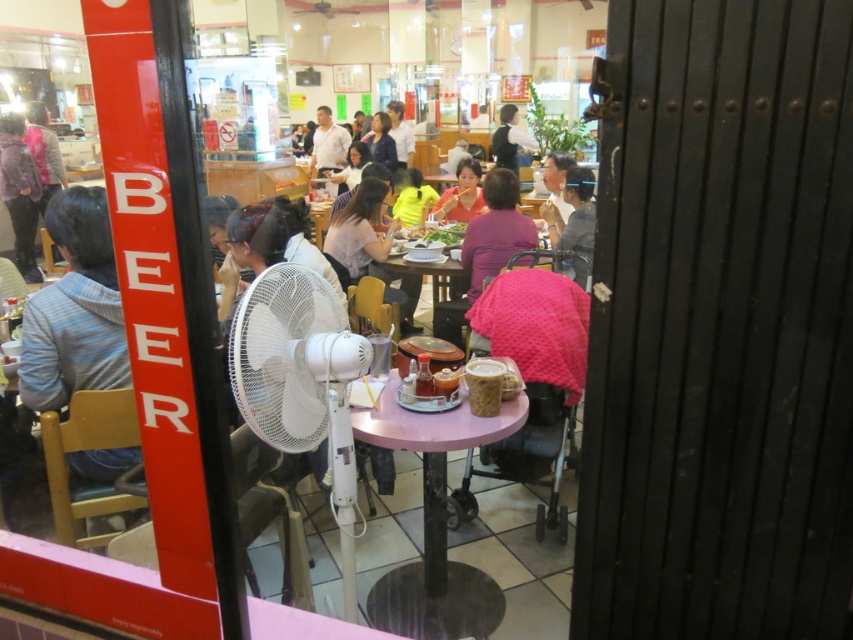
Question: Among these objects, which one is farthest from the camera?

Choices:
 (A) matte gray shirt at center
 (B) purple matte table at center

Answer: (A)

Question: Estimate the real-world distances between objects in this image. Which object is farther from the matte gray shirt at center?

Choices:
 (A) striped sweater at left
 (B) purple matte table at center
 (C) white plastic fan at center

Answer: (A)

Question: Does purple matte table at center appear under green leafy vegetables at center?

Choices:
 (A) no
 (B) yes

Answer: (B)

Question: Is matte pink shirt at center thinner than white matte shirt at center?

Choices:
 (A) yes
 (B) no

Answer: (A)

Question: Can you confirm if purple matte table at center is smaller than matte gray shirt at center?

Choices:
 (A) yes
 (B) no

Answer: (B)

Question: Among these objects, which one is nearest to the camera?

Choices:
 (A) matte black jacket at left
 (B) white matte shirt at center
 (C) striped sweater at left
 (D) dark blue shirt at center

Answer: (C)